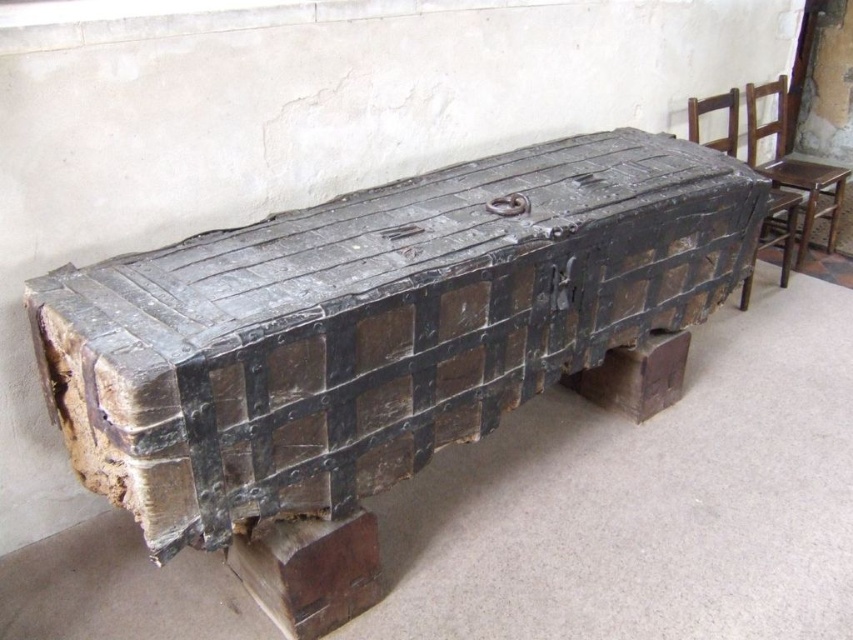
Which of these two, dark brown wooden chair at right or wooden chair at right, stands taller?

Standing taller between the two is dark brown wooden chair at right.

Does point (689, 118) come closer to viewer compared to point (730, 99)?

Yes, it is.

Locate an element on the screen. This screenshot has width=853, height=640. dark brown wooden chair at right is located at coordinates (712, 109).

Is brown wooden chair at right above wooden chair at right?

No.

Which is behind, point (776, 100) or point (729, 152)?

The point (776, 100) is more distant.

The height and width of the screenshot is (640, 853). I want to click on brown wooden chair at right, so click(793, 168).

Does rusty metal trunk at center appear over dark brown wooden chair at right?

No.

Can you confirm if rusty metal trunk at center is wider than dark brown wooden chair at right?

Indeed, rusty metal trunk at center has a greater width compared to dark brown wooden chair at right.

Between point (254, 477) and point (692, 104), which one is positioned behind?

Positioned behind is point (692, 104).

You are a GUI agent. You are given a task and a screenshot of the screen. Output one action in this format:
    pyautogui.click(x=<x>, y=<y>)
    Task: Click on the rusty metal trunk at center
    The width and height of the screenshot is (853, 640).
    Given the screenshot: What is the action you would take?
    [379, 344]